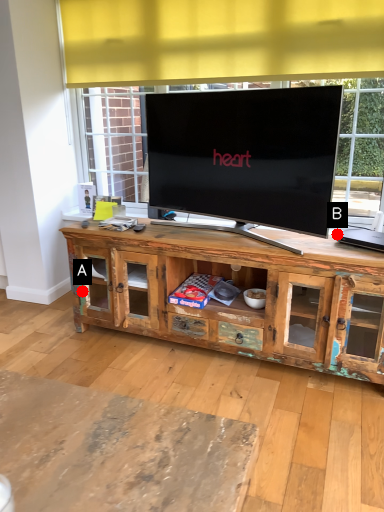
Question: Two points are circled on the image, labeled by A and B beside each circle. Among these points, which one is farthest from the camera?

Choices:
 (A) A is further
 (B) B is further

Answer: (A)